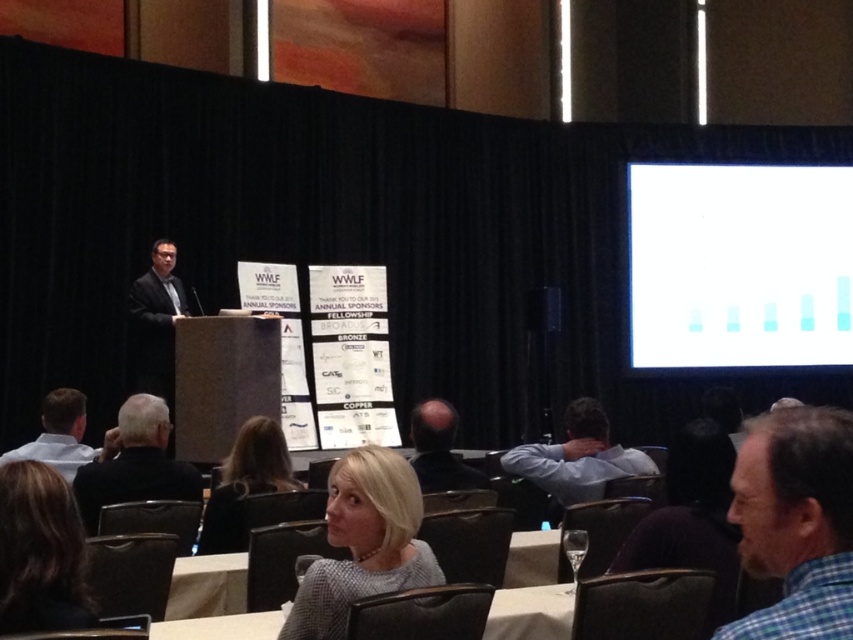
Is black fabric jacket at lower left below white shirt at lower left?

Incorrect, black fabric jacket at lower left is not positioned below white shirt at lower left.

Can you confirm if black fabric jacket at lower left is wider than white shirt at lower left?

In fact, black fabric jacket at lower left might be narrower than white shirt at lower left.

Locate an element on the screen. This screenshot has height=640, width=853. black fabric jacket at lower left is located at coordinates (134, 464).

Is blonde hair at center wider than smooth bald head at center?

Correct, the width of blonde hair at center exceeds that of smooth bald head at center.

Between blonde hair at center and smooth bald head at center, which one is positioned higher?

smooth bald head at center is higher up.

You are a GUI agent. You are given a task and a screenshot of the screen. Output one action in this format:
    pyautogui.click(x=<x>, y=<y>)
    Task: Click on the blonde hair at center
    The height and width of the screenshot is (640, 853).
    Given the screenshot: What is the action you would take?
    pyautogui.click(x=245, y=483)

Image resolution: width=853 pixels, height=640 pixels. Find the location of `blonde hair at center`. blonde hair at center is located at coordinates (245, 483).

Consider the image. Which is above, white matte graph at upper right or dark gray suit at center?

white matte graph at upper right is higher up.

What do you see at coordinates (740, 266) in the screenshot?
I see `white matte graph at upper right` at bounding box center [740, 266].

Where is `white matte graph at upper right`? white matte graph at upper right is located at coordinates (740, 266).